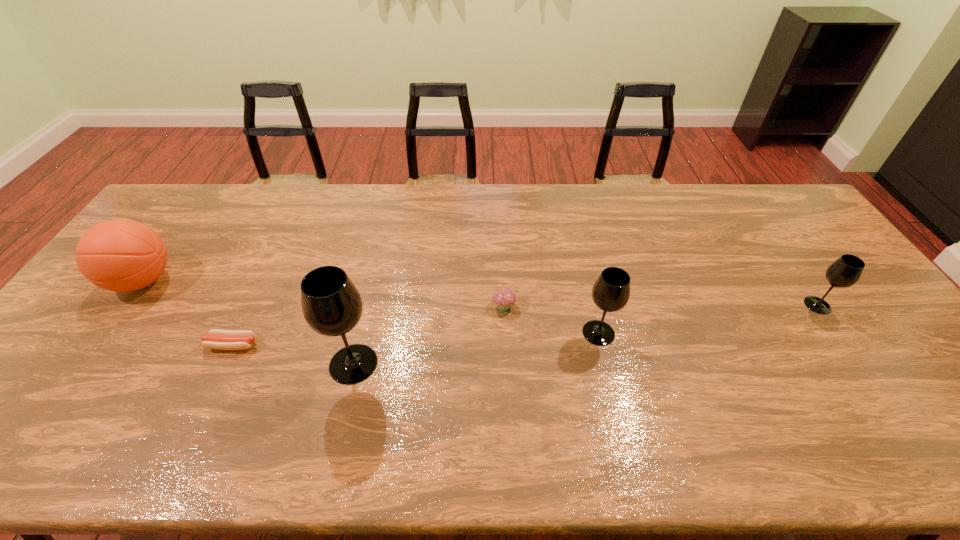
This screenshot has height=540, width=960. I want to click on the fourth object from right to left, so click(332, 306).

The image size is (960, 540). What are the coordinates of `the leftmost wineglass` in the screenshot? It's located at (332, 306).

Where is `the second object from right to left`? This screenshot has width=960, height=540. the second object from right to left is located at coordinates (611, 291).

At what (x,y) coordinates should I click in order to perform the action: click on the second wineglass from right to left. Please return your answer as a coordinate pair (x, y). Looking at the image, I should click on (611, 291).

You are a GUI agent. You are given a task and a screenshot of the screen. Output one action in this format:
    pyautogui.click(x=<x>, y=<y>)
    Task: Click on the fourth tallest object
    
    Given the screenshot: What is the action you would take?
    pyautogui.click(x=844, y=272)

Locate an element on the screen. Image resolution: width=960 pixels, height=540 pixels. the farthest wineglass is located at coordinates (844, 272).

Identify the location of the third object from right to left. The height and width of the screenshot is (540, 960). (504, 298).

Where is `the fifth tallest object`? The width and height of the screenshot is (960, 540). the fifth tallest object is located at coordinates click(x=504, y=298).

Where is `the shortest object`? the shortest object is located at coordinates (217, 339).

This screenshot has height=540, width=960. Find the location of `sausage`. sausage is located at coordinates (217, 339).